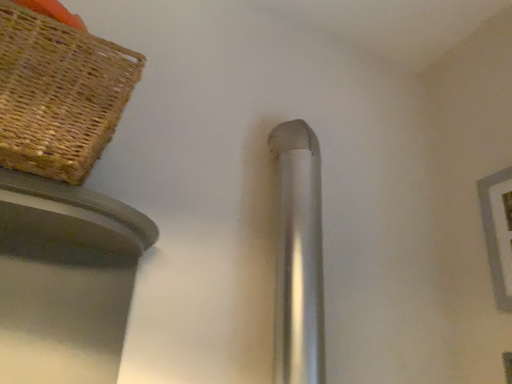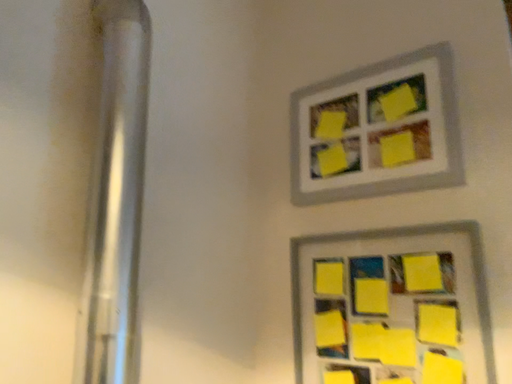
Question: How did the camera likely rotate when shooting the video?

Choices:
 (A) rotated downward
 (B) rotated upward

Answer: (A)